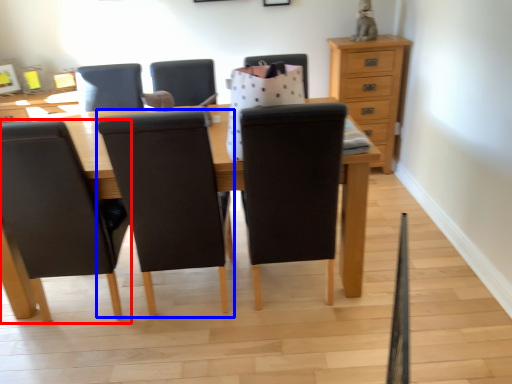
Question: Among these objects, which one is nearest to the camera, chair (highlighted by a red box) or chair (highlighted by a blue box)?

Choices:
 (A) chair
 (B) chair

Answer: (B)